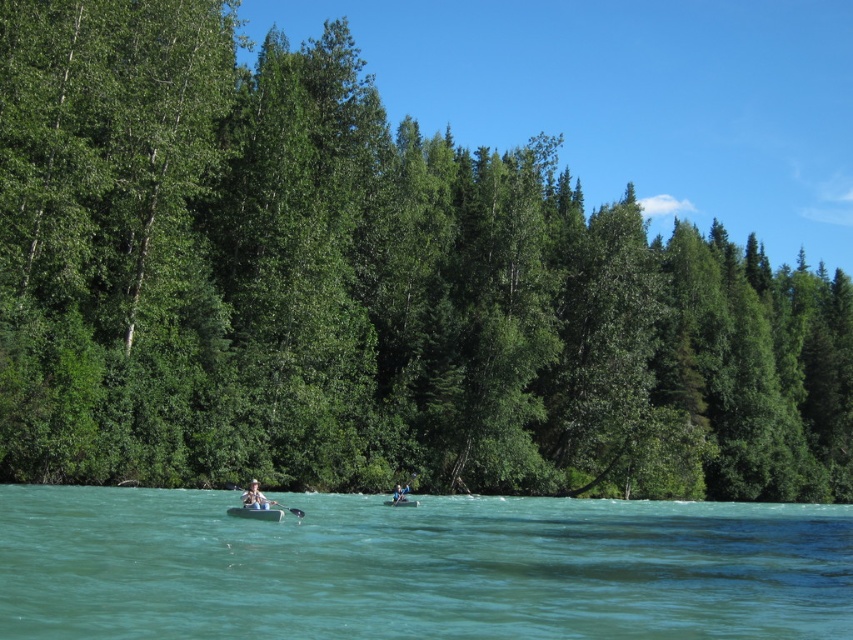
Question: Observing the image, what is the correct spatial positioning of clear turquoise water at center in reference to matte white canoe at center?

Choices:
 (A) left
 (B) right

Answer: (B)

Question: Can you confirm if smooth white paddle at center is bigger than green rubber boat at center?

Choices:
 (A) yes
 (B) no

Answer: (A)

Question: Which is nearer to the clear turquoise water at center?

Choices:
 (A) light brown wooden paddleboard at center
 (B) green rubber boat at center

Answer: (B)

Question: Which point appears closest to the camera in this image?

Choices:
 (A) (402, 486)
 (B) (251, 486)
 (C) (613, 596)

Answer: (C)

Question: Can you confirm if clear turquoise water at center is positioned below smooth white paddle at center?

Choices:
 (A) no
 (B) yes

Answer: (B)

Question: Which object is positioned closest to the light brown wooden paddleboard at center?

Choices:
 (A) clear turquoise water at center
 (B) matte white canoe at center
 (C) light brown wooden paddle at center
 (D) green rubber boat at center

Answer: (D)